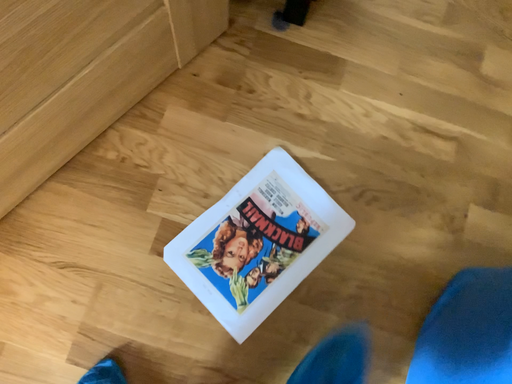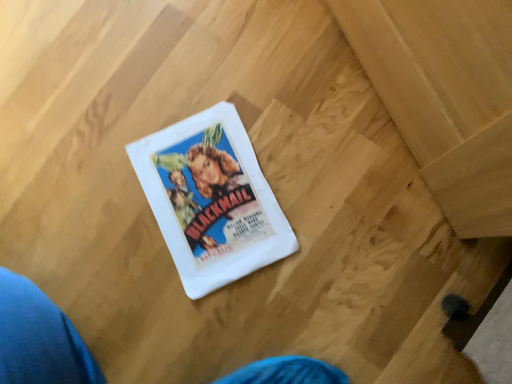
Question: How did the camera likely rotate when shooting the video?

Choices:
 (A) rotated downward
 (B) rotated upward

Answer: (B)